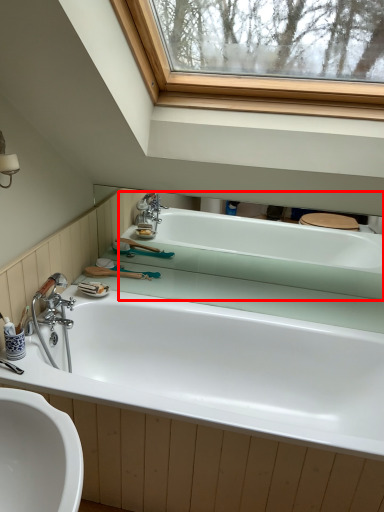
Question: Where is bathtub (annotated by the red box) located in relation to bathtub in the image?

Choices:
 (A) right
 (B) left

Answer: (A)